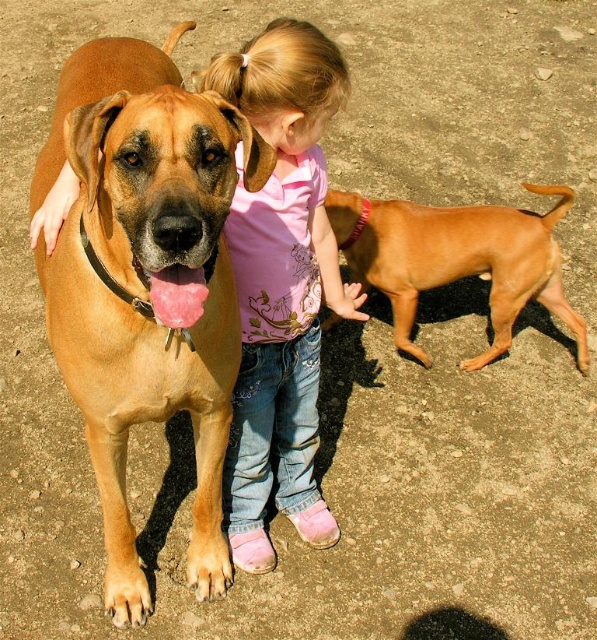
Can you confirm if matte brown dog at center is bigger than smooth tan dog at center?

Indeed, matte brown dog at center has a larger size compared to smooth tan dog at center.

Find the location of a particular element. This screenshot has width=597, height=640. matte brown dog at center is located at coordinates (146, 282).

Can you confirm if matte brown dog at center is shorter than pink cotton shirt at center?

No.

Which is above, matte brown dog at center or pink cotton shirt at center?

pink cotton shirt at center

You are a GUI agent. You are given a task and a screenshot of the screen. Output one action in this format:
    pyautogui.click(x=<x>, y=<y>)
    Task: Click on the matte brown dog at center
    The height and width of the screenshot is (640, 597).
    Given the screenshot: What is the action you would take?
    pyautogui.click(x=146, y=282)

Find the location of a particular element. The width and height of the screenshot is (597, 640). matte brown dog at center is located at coordinates (146, 282).

Does pink cotton shirt at center have a lesser width compared to smooth tan dog at center?

Yes, pink cotton shirt at center is thinner than smooth tan dog at center.

Which is above, pink cotton shirt at center or smooth tan dog at center?

Positioned higher is smooth tan dog at center.

The image size is (597, 640). In order to click on pink cotton shirt at center in this screenshot , I will do `click(281, 284)`.